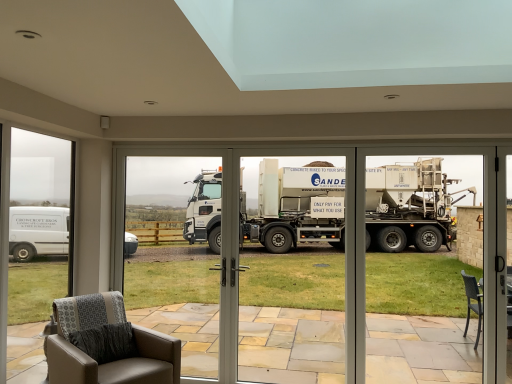
Question: Is white glossy truck at center, which is the second garage door in left-to-right order, inside or outside of clear glass window at left?

Choices:
 (A) inside
 (B) outside

Answer: (B)

Question: Based on their positions, is white glossy truck at center, which is the second garage door in left-to-right order, located to the left or right of clear glass window at left?

Choices:
 (A) left
 (B) right

Answer: (B)

Question: Which object is positioned closest to the clear glass window at left?

Choices:
 (A) leather armchair at lower left
 (B) white glossy truck at center, which is the second garage door in left-to-right order
 (C) transparent glass door at center
 (D) white matte truck at center, placed as the 1th garage door when sorted from left to right

Answer: (A)

Question: Estimate the real-world distances between objects in this image. Which object is farther from the transparent glass door at center?

Choices:
 (A) white matte truck at center, placed as the 1th garage door when sorted from left to right
 (B) leather armchair at lower left
 (C) white glossy truck at center, which is the second garage door in left-to-right order
 (D) clear glass window at left

Answer: (B)